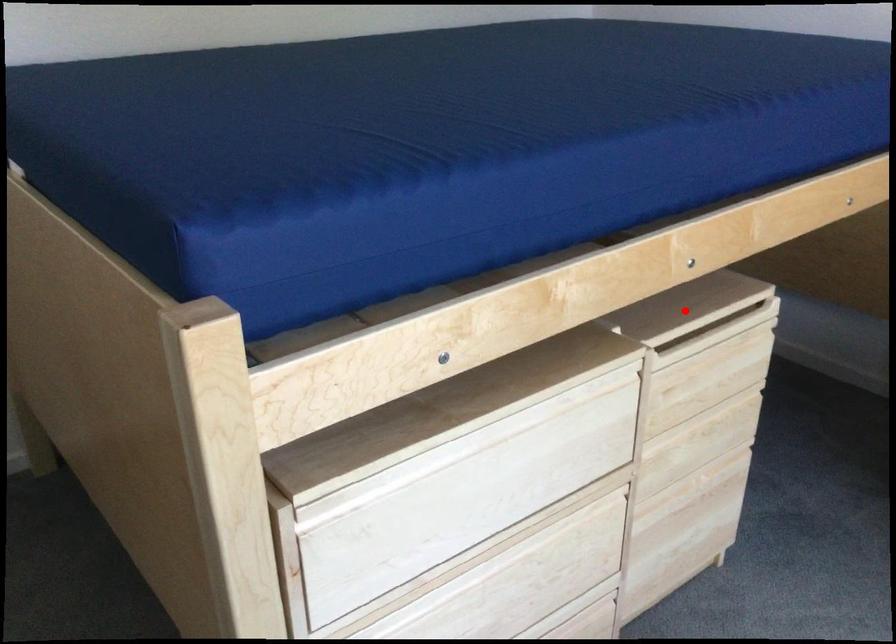
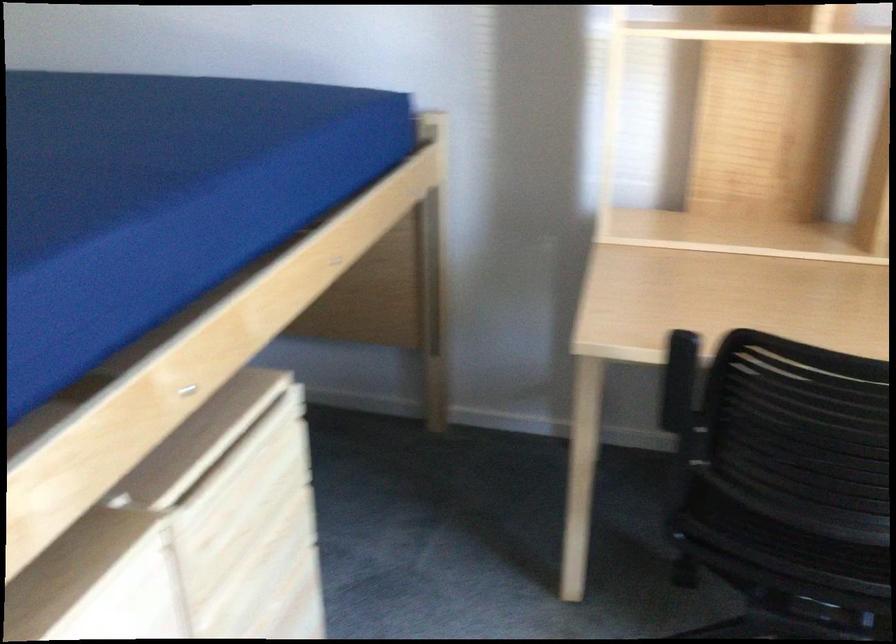
Question: I am providing you with two images of the same scene from different viewpoints. A red point is shown in image1. For the corresponding object point in image2, is it positioned nearer or farther from the camera?

Choices:
 (A) Nearer
 (B) Farther

Answer: (A)